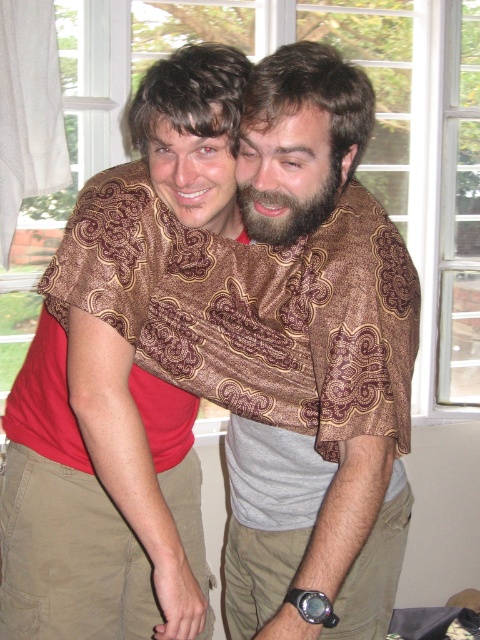
Question: Which object is farther from the camera taking this photo?

Choices:
 (A) brown patterned scarf at center
 (B) brown fuzzy beard at center

Answer: (B)

Question: Can you confirm if brown patterned scarf at center is positioned to the left of brown fuzzy beard at center?

Choices:
 (A) no
 (B) yes

Answer: (A)

Question: Can you confirm if brown patterned scarf at center is positioned to the right of brown fuzzy beard at center?

Choices:
 (A) no
 (B) yes

Answer: (B)

Question: Which point is farther from the camera taking this photo?

Choices:
 (A) (370, 554)
 (B) (321, 161)

Answer: (A)

Question: Which object appears closest to the camera in this image?

Choices:
 (A) brown patterned scarf at center
 (B) brown fuzzy beard at center

Answer: (A)

Question: Is brown patterned scarf at center behind brown fuzzy beard at center?

Choices:
 (A) no
 (B) yes

Answer: (A)